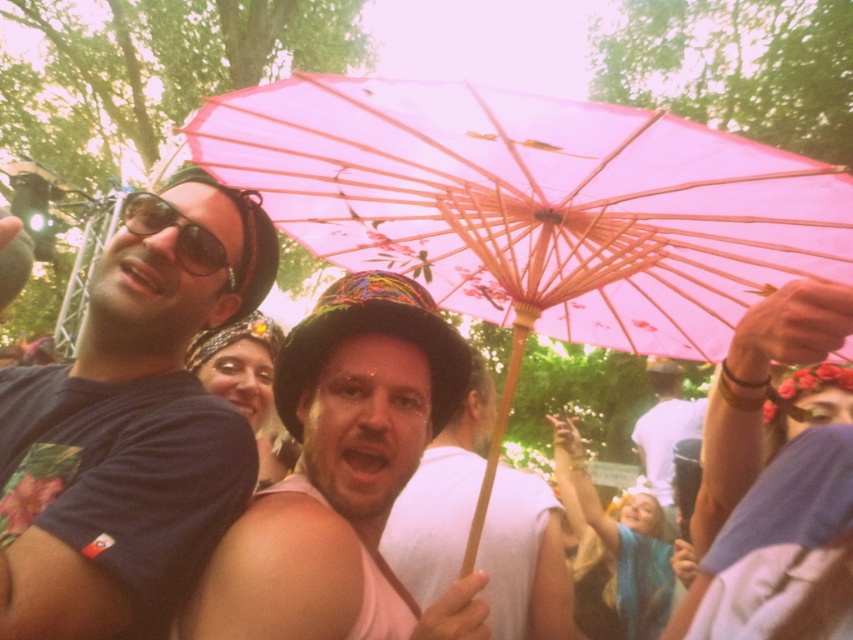
Question: Observing the image, what is the correct spatial positioning of matte black t-shirt at left in reference to matte black hat at center?

Choices:
 (A) below
 (B) above

Answer: (B)

Question: Which point is farther to the camera?

Choices:
 (A) (434, 472)
 (B) (234, 280)
 (C) (648, 460)
 (D) (422, 362)

Answer: (C)

Question: Among these points, which one is nearest to the camera?

Choices:
 (A) (637, 202)
 (B) (86, 493)

Answer: (B)

Question: Which point is farther to the camera?

Choices:
 (A) pink paper umbrella at center
 (B) white matte shirt at center

Answer: (B)

Question: Can you confirm if matte black t-shirt at left is positioned below matte black goggles at upper left?

Choices:
 (A) yes
 (B) no

Answer: (A)

Question: Is the position of matte black t-shirt at left more distant than that of matte black hat at center?

Choices:
 (A) no
 (B) yes

Answer: (A)